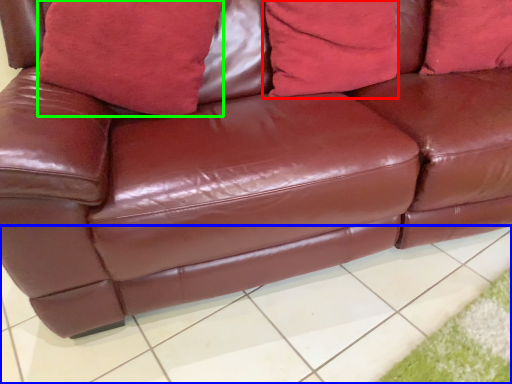
Question: Based on their relative distances, which object is farther from pillow (highlighted by a red box)? Choose from tile (highlighted by a blue box) and pillow (highlighted by a green box).

Choices:
 (A) tile
 (B) pillow

Answer: (A)